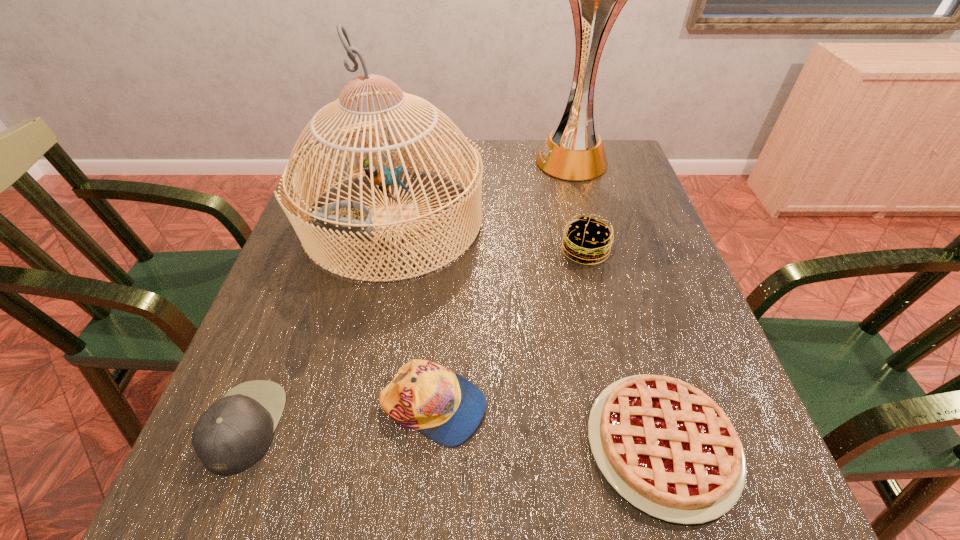
Find the location of a particular element. This screenshot has width=960, height=540. trophy that is positioned at the right edge is located at coordinates (573, 151).

Find the location of `patty that is positioned at the right edge`. patty that is positioned at the right edge is located at coordinates (586, 240).

Find the location of a particular element. The height and width of the screenshot is (540, 960). pie that is at the right edge is located at coordinates (666, 447).

Locate an element on the screen. The height and width of the screenshot is (540, 960). object at the far left corner is located at coordinates (347, 218).

In order to click on object that is at the near left corner in this screenshot , I will do `click(230, 436)`.

You are a GUI agent. You are given a task and a screenshot of the screen. Output one action in this format:
    pyautogui.click(x=<x>, y=<y>)
    Task: Click on the object that is at the far right corner
    The image size is (960, 540).
    Given the screenshot: What is the action you would take?
    pyautogui.click(x=573, y=151)

At what (x,y) coordinates should I click in order to perform the action: click on object located at the near right corner. Please return your answer as a coordinate pair (x, y). This screenshot has height=540, width=960. Looking at the image, I should click on (666, 447).

In the image, there is a desktop. At what (x,y) coordinates should I click in order to perform the action: click on vacant space at the near edge. Please return your answer as a coordinate pair (x, y). Image resolution: width=960 pixels, height=540 pixels. Looking at the image, I should click on (501, 476).

Identify the location of vacant position at the left edge of the desktop. (287, 255).

Find the location of `vacant area at the right edge`. vacant area at the right edge is located at coordinates (732, 392).